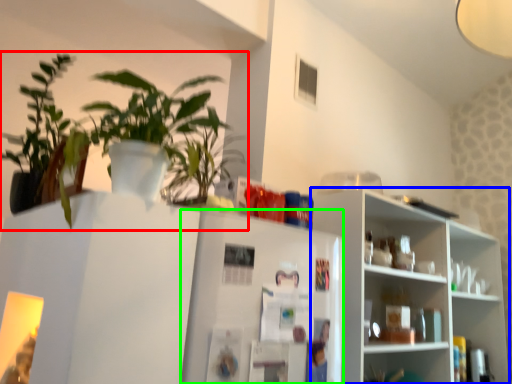
Question: Based on their relative distances, which object is farther from houseplant (highlighted by a red box)? Choose from shelf (highlighted by a blue box) and fridge (highlighted by a green box).

Choices:
 (A) shelf
 (B) fridge

Answer: (A)